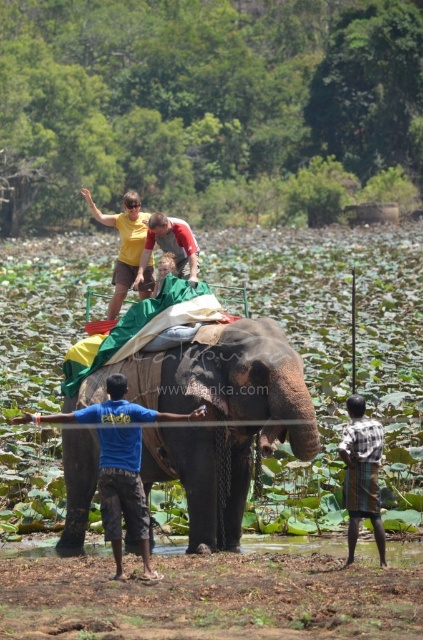
You are a photographer trying to capture a closeup of the yellow fabric at center. You notice a plaid shirt at lower right in the frame. Based on their sizes, which object would appear larger in your photo?

The yellow fabric at center would appear larger in the photo since it is bigger than the plaid shirt at lower right.

In the scene shown: What are the coordinates of the blue cotton shirt at center?

The blue cotton shirt at center is located at coordinates point (123, 493).

You are a tour guide leading a group in the park. You need to ensure all guests are within a safe distance of 3 meters from the elephant for safety. Two guests are wearing a blue cotton shirt at center and a plaid shirt at lower right. Are both guests within the safe distance requirement?

The distance between the blue cotton shirt at center and the plaid shirt at lower right is 3.11 meters. Since the safe distance requirement is 3 meters, the guests are slightly beyond the recommended distance and should move closer to ensure safety.